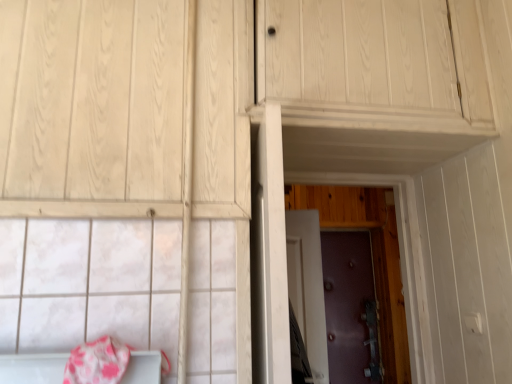
Question: Could you tell me if pink fabric blanket at lower left is facing purple textured door at center, arranged as the 3th door when viewed from the back?

Choices:
 (A) yes
 (B) no

Answer: (B)

Question: Does pink fabric blanket at lower left lie behind purple textured door at center, arranged as the 3th door when viewed from the back?

Choices:
 (A) yes
 (B) no

Answer: (B)

Question: Is pink fabric blanket at lower left placed right next to purple textured door at center, arranged as the first door when viewed from the front?

Choices:
 (A) yes
 (B) no

Answer: (B)

Question: From a real-world perspective, is pink fabric blanket at lower left on top of purple textured door at center, arranged as the 3th door when viewed from the back?

Choices:
 (A) yes
 (B) no

Answer: (B)

Question: Would you say purple textured door at center, arranged as the first door when viewed from the front, is part of pink fabric blanket at lower left's contents?

Choices:
 (A) no
 (B) yes

Answer: (A)

Question: Can you confirm if pink fabric blanket at lower left is smaller than purple textured door at center, arranged as the first door when viewed from the front?

Choices:
 (A) yes
 (B) no

Answer: (A)

Question: Is the position of purple leather door at center, marked as the third door in a front-to-back arrangement, more distant than that of pink fabric blanket at lower left?

Choices:
 (A) no
 (B) yes

Answer: (B)

Question: Is purple leather door at center, marked as the third door in a front-to-back arrangement, touching pink fabric blanket at lower left?

Choices:
 (A) no
 (B) yes

Answer: (A)

Question: Considering the relative positions of purple leather door at center, the first door positioned from the back, and pink fabric blanket at lower left in the image provided, is purple leather door at center, the first door positioned from the back, to the left of pink fabric blanket at lower left from the viewer's perspective?

Choices:
 (A) yes
 (B) no

Answer: (B)

Question: From a real-world perspective, is purple leather door at center, the first door positioned from the back, over pink fabric blanket at lower left?

Choices:
 (A) yes
 (B) no

Answer: (B)

Question: Is pink fabric blanket at lower left a part of purple leather door at center, marked as the third door in a front-to-back arrangement?

Choices:
 (A) yes
 (B) no

Answer: (B)

Question: From a real-world perspective, is purple leather door at center, marked as the third door in a front-to-back arrangement, below pink fabric blanket at lower left?

Choices:
 (A) no
 (B) yes

Answer: (B)

Question: Can you confirm if purple matte door at center, the second door viewed from the front, is thinner than purple textured door at center, arranged as the first door when viewed from the front?

Choices:
 (A) no
 (B) yes

Answer: (A)